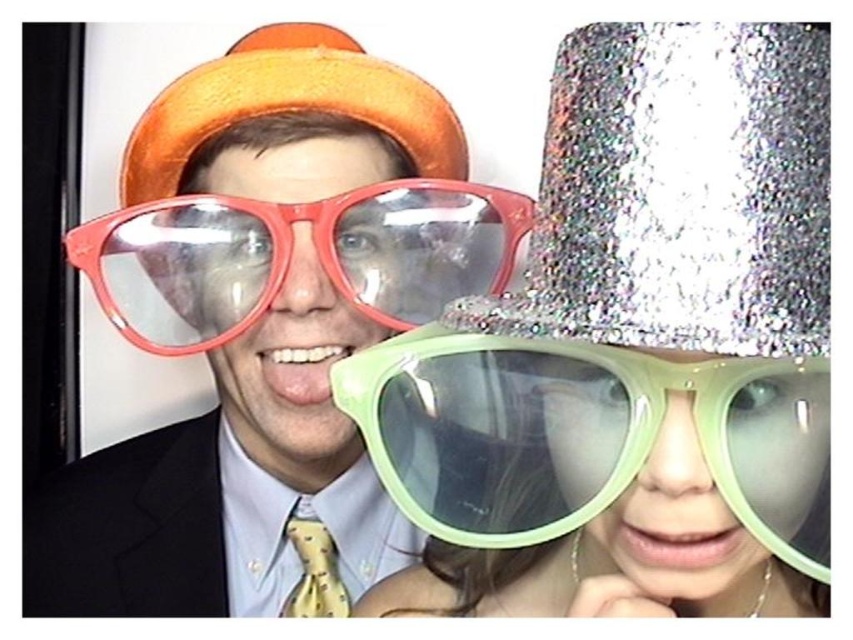
You are a photographer who needs to adjust the lighting for a closeup shot of the translucent plastic goggles at center. You want to ensure that the glittery silver hat at upper right does not cast a shadow on the goggles. Given that the light source is 1 meter away from the goggles, is the hat close enough to potentially cast a shadow?

The distance between the glittery silver hat at upper right and the translucent plastic goggles at center is 31.83 centimeters. Since the light source is 1 meter away from the goggles, the hat is within the shadow casting range and could potentially cast a shadow on the goggles.

You are a photographer trying to frame a photo of the matte orange hat at upper left and the yellow dotted tie at center. Which object should you adjust your camera to focus on first if you want to capture both in a single shot without zooming in or out?

The matte orange hat at upper left is wider than the yellow dotted tie at center, so you should focus on the matte orange hat at upper left first to ensure it fits within the frame before adjusting for the smaller yellow dotted tie at center.

You are at a party and want to take a photo with both the translucent plastic goggles at center and the orange felt hat at upper center. Which object should you move to the left to ensure both are visible in the frame?

The translucent plastic goggles at center is positioned on the right side of orange felt hat at upper center. To ensure both are visible, move the orange felt hat at upper center to the left so that there is space between it and the goggles.